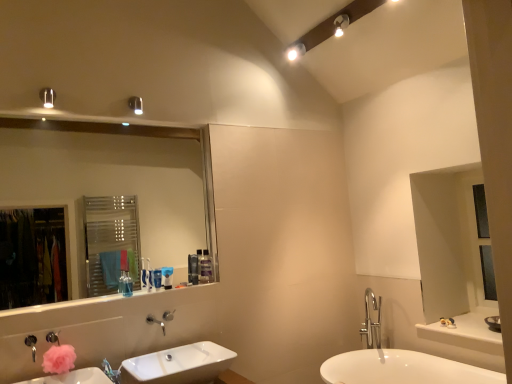
Question: Can you confirm if satin black soap dispenser at upper center, the second toiletry positioned from the back, is positioned to the left of matte white light fixture at upper center, placed as the fourth light fixture when sorted from bottom to top?

Choices:
 (A) yes
 (B) no

Answer: (A)

Question: Can you confirm if satin black soap dispenser at upper center, the second toiletry positioned from the back, is wider than matte white light fixture at upper center, the fourth light fixture positioned from the left?

Choices:
 (A) no
 (B) yes

Answer: (A)

Question: Does satin black soap dispenser at upper center, acting as the 2th toiletry starting from the right, have a smaller size compared to matte white light fixture at upper center, placed as the 1th light fixture when sorted from top to bottom?

Choices:
 (A) no
 (B) yes

Answer: (B)

Question: Does satin black soap dispenser at upper center, the second toiletry positioned from the back, have a larger size compared to matte white light fixture at upper center, which is the 1th light fixture from right to left?

Choices:
 (A) no
 (B) yes

Answer: (A)

Question: Is the surface of satin black soap dispenser at upper center, which appears as the fourth toiletry when viewed from the left, in direct contact with matte white light fixture at upper center, arranged as the third light fixture when viewed from the front?

Choices:
 (A) no
 (B) yes

Answer: (A)

Question: Is satin black soap dispenser at upper center, which is counted as the 4th toiletry, starting from the front, at the right side of matte white light fixture at upper center, placed as the 1th light fixture when sorted from top to bottom?

Choices:
 (A) no
 (B) yes

Answer: (A)

Question: From a real-world perspective, is brushed metal faucet at lower left positioned over clear glass mirror at upper left based on gravity?

Choices:
 (A) yes
 (B) no

Answer: (B)

Question: Does brushed metal faucet at lower left have a larger size compared to clear glass mirror at upper left?

Choices:
 (A) yes
 (B) no

Answer: (B)

Question: Can you confirm if brushed metal faucet at lower left is taller than clear glass mirror at upper left?

Choices:
 (A) no
 (B) yes

Answer: (A)

Question: Is brushed metal faucet at lower left positioned beyond the bounds of clear glass mirror at upper left?

Choices:
 (A) no
 (B) yes

Answer: (B)

Question: Considering the relative sizes of brushed metal faucet at lower left and clear glass mirror at upper left in the image provided, is brushed metal faucet at lower left wider than clear glass mirror at upper left?

Choices:
 (A) no
 (B) yes

Answer: (A)

Question: Is brushed metal faucet at lower left looking in the opposite direction of clear glass mirror at upper left?

Choices:
 (A) no
 (B) yes

Answer: (A)

Question: Considering the relative sizes of satin black soap dispenser at upper center, acting as the 2th toiletry starting from the right, and blue plastic toothbrush at upper center, the 3th toiletry positioned from the right, in the image provided, is satin black soap dispenser at upper center, acting as the 2th toiletry starting from the right, wider than blue plastic toothbrush at upper center, the 3th toiletry positioned from the right,?

Choices:
 (A) yes
 (B) no

Answer: (A)